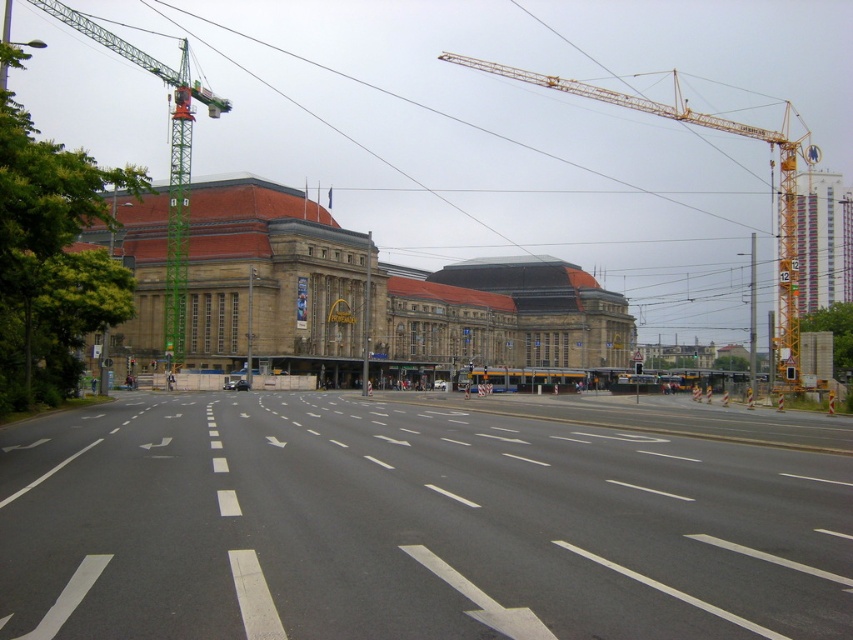
You are standing on the road in front of the historic building and looking towards the building. There are two points marked on the road ahead of you. The first point is at coordinates point (547, 332) and the second point is at coordinates point (791, 376). Which point is closer to you?

The point at (547, 332) is closer to you because it is further to the camera than the other point, meaning it is nearer in the scene.

You are a city planner assessing the urban layout. You need to determine if the green metal crane at left can be moved to the position currently occupied by the yellow plastic traffic light at center without obstructing the traffic light. Based on their sizes, is this feasible?

The green metal crane at left has a larger width than the yellow plastic traffic light at center. Moving the crane to the traffic light position would likely obstruct it due to its greater width.

You are a pedestrian standing on the sidewalk and want to cross the street to reach the historic building. There is a green metal crane at left and a yellow plastic traffic light at center. Which object should you look at first to check for traffic safety?

You should look at the yellow plastic traffic light at center first because it is closer to the crossing point near the historic building, and it controls traffic flow at the intersection. The green metal crane at left is positioned further away from the crossing area, so checking the traffic light would provide more relevant information about when it is safe to cross.